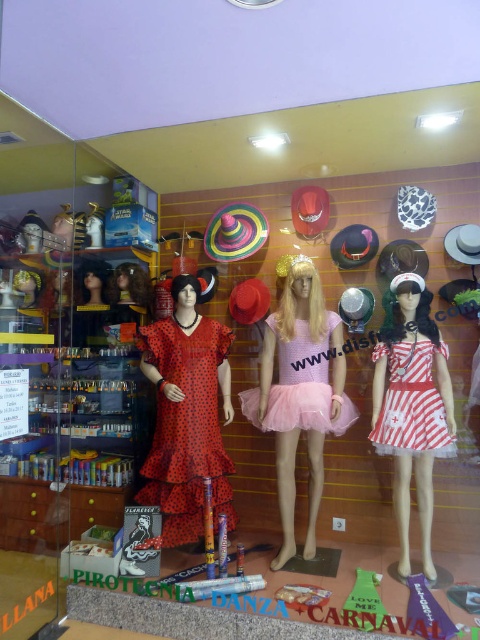
Question: Based on their relative distances, which object is farther from the pink tulle dress at center?

Choices:
 (A) red striped dress at center
 (B) pink crochet tutu at center
 (C) black matte wig at center

Answer: (C)

Question: Which point is closer to the camera?

Choices:
 (A) pink crochet tutu at center
 (B) blonde synthetic wig at center
 (C) red dotted fabric dress at center

Answer: (A)

Question: Can you confirm if red striped dress at center is wider than blonde synthetic wig at center?

Choices:
 (A) no
 (B) yes

Answer: (B)

Question: Among these points, which one is nearest to the camera?

Choices:
 (A) (259, 400)
 (B) (147, 490)
 (C) (312, 337)
 (D) (408, 288)

Answer: (D)

Question: Can you confirm if pink crochet tutu at center is bigger than red striped dress at center?

Choices:
 (A) yes
 (B) no

Answer: (A)

Question: From the image, what is the correct spatial relationship of pink crochet tutu at center in relation to red dotted fabric dress at center?

Choices:
 (A) left
 (B) right

Answer: (B)